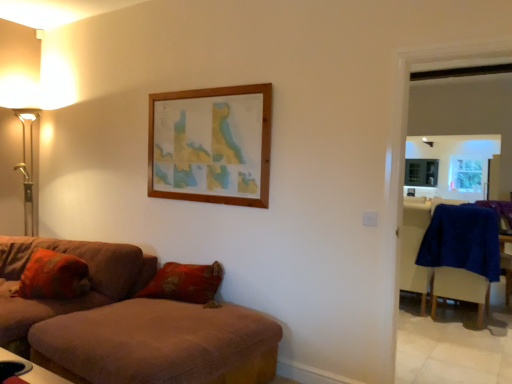
The image size is (512, 384). What do you see at coordinates (53, 276) in the screenshot?
I see `textured orange pillow at lower left` at bounding box center [53, 276].

This screenshot has width=512, height=384. Describe the element at coordinates (462, 254) in the screenshot. I see `blue fuzzy swivel chair at right` at that location.

This screenshot has width=512, height=384. Describe the element at coordinates (131, 324) in the screenshot. I see `brown fabric ottoman at lower left, the 2th studio couch when ordered from left to right` at that location.

Identify the location of gold metallic floor lamp at left. The image size is (512, 384). (35, 87).

What do you see at coordinates (35, 87) in the screenshot?
I see `gold metallic floor lamp at left` at bounding box center [35, 87].

Locate an element on the screen. Image resolution: width=512 pixels, height=384 pixels. brown fabric couch at lower left, arranged as the 2th studio couch when viewed from the right is located at coordinates [73, 298].

From a real-world perspective, which is physically below, brown fabric couch at lower left, arranged as the 2th studio couch when viewed from the right, or blue fabric armchair at right?

brown fabric couch at lower left, arranged as the 2th studio couch when viewed from the right, is physically lower.

In terms of width, does brown fabric couch at lower left, which is the 1th studio couch in left-to-right order, look wider or thinner when compared to blue fabric armchair at right?

In the image, brown fabric couch at lower left, which is the 1th studio couch in left-to-right order, appears to be wider than blue fabric armchair at right.

Is brown fabric couch at lower left, arranged as the 2th studio couch when viewed from the right, in front of or behind blue fabric armchair at right in the image?

In the image, brown fabric couch at lower left, arranged as the 2th studio couch when viewed from the right, appears in front of blue fabric armchair at right.

Consider the image. Can you confirm if brown fabric couch at lower left, arranged as the 2th studio couch when viewed from the right, is shorter than blue fabric armchair at right?

Correct, brown fabric couch at lower left, arranged as the 2th studio couch when viewed from the right, is not as tall as blue fabric armchair at right.

Between brown fabric ottoman at lower left, placed as the first studio couch when sorted from right to left, and textured orange pillow at lower left, which one has less height?

textured orange pillow at lower left is shorter.

Consider the image. Is brown fabric ottoman at lower left, placed as the first studio couch when sorted from right to left, positioned beyond the bounds of textured orange pillow at lower left?

That's correct, brown fabric ottoman at lower left, placed as the first studio couch when sorted from right to left, is outside of textured orange pillow at lower left.

Is point (122, 245) closer to camera compared to point (67, 274)?

No, it is behind (67, 274).

Is brown fabric ottoman at lower left, placed as the first studio couch when sorted from right to left, positioned with its back to textured orange pillow at lower left?

No, brown fabric ottoman at lower left, placed as the first studio couch when sorted from right to left, is not facing the opposite direction of textured orange pillow at lower left.

Which is closer, (413, 263) or (50, 282)?

Point (413, 263).

From the image's perspective, is blue fabric armchair at right positioned above or below textured orange pillow at lower left?

blue fabric armchair at right is below textured orange pillow at lower left.

From a real-world perspective, which object stands above the other?

textured orange pillow at lower left.

Is blue fabric armchair at right oriented towards textured orange pillow at lower left?

No.

Relative to gold metallic floor lamp at left, is brown fabric ottoman at lower left, the 2th studio couch when ordered from left to right, in front or behind?

Clearly, brown fabric ottoman at lower left, the 2th studio couch when ordered from left to right, is in front of gold metallic floor lamp at left.

Is brown fabric ottoman at lower left, placed as the first studio couch when sorted from right to left, oriented away from gold metallic floor lamp at left?

No, gold metallic floor lamp at left is not at the back of brown fabric ottoman at lower left, placed as the first studio couch when sorted from right to left.

How different are the orientations of brown fabric ottoman at lower left, the 2th studio couch when ordered from left to right, and gold metallic floor lamp at left in degrees?

There is a 92.9-degree angle between the facing directions of brown fabric ottoman at lower left, the 2th studio couch when ordered from left to right, and gold metallic floor lamp at left.

Are brown fabric ottoman at lower left, the 2th studio couch when ordered from left to right, and gold metallic floor lamp at left making contact?

No, brown fabric ottoman at lower left, the 2th studio couch when ordered from left to right, is not touching gold metallic floor lamp at left.

From the image's perspective, which is below, blue fabric armchair at right or blue fuzzy swivel chair at right?

blue fuzzy swivel chair at right is shown below in the image.

Does blue fabric armchair at right have a larger size compared to blue fuzzy swivel chair at right?

Incorrect, blue fabric armchair at right is not larger than blue fuzzy swivel chair at right.

Does point (407, 242) lie in front of point (439, 250)?

No.

Would you say blue fuzzy swivel chair at right is part of blue fabric armchair at right's contents?

Definitely not — blue fuzzy swivel chair at right is not inside blue fabric armchair at right.

Which object is positioned more to the left, blue fuzzy swivel chair at right or brown fabric couch at lower left, arranged as the 2th studio couch when viewed from the right?

brown fabric couch at lower left, arranged as the 2th studio couch when viewed from the right, is more to the left.

Is brown fabric couch at lower left, which is the 1th studio couch in left-to-right order, at the back of blue fuzzy swivel chair at right?

blue fuzzy swivel chair at right is not turned away from brown fabric couch at lower left, which is the 1th studio couch in left-to-right order.

In the scene shown: Is blue fuzzy swivel chair at right wider than brown fabric couch at lower left, which is the 1th studio couch in left-to-right order?

In fact, blue fuzzy swivel chair at right might be narrower than brown fabric couch at lower left, which is the 1th studio couch in left-to-right order.

Considering the sizes of objects blue fuzzy swivel chair at right and brown fabric couch at lower left, which is the 1th studio couch in left-to-right order, in the image provided, who is taller, blue fuzzy swivel chair at right or brown fabric couch at lower left, which is the 1th studio couch in left-to-right order,?

blue fuzzy swivel chair at right is taller.

Does point (34, 242) come farther from viewer compared to point (153, 269)?

Yes.

From the image's perspective, is brown fabric ottoman at lower left, the 2th studio couch when ordered from left to right, located above brown fabric couch at lower left, which is the 1th studio couch in left-to-right order?

No, from the image's perspective, brown fabric ottoman at lower left, the 2th studio couch when ordered from left to right, is not over brown fabric couch at lower left, which is the 1th studio couch in left-to-right order.

Does brown fabric ottoman at lower left, the 2th studio couch when ordered from left to right, have a greater width compared to brown fabric couch at lower left, which is the 1th studio couch in left-to-right order?

Incorrect, the width of brown fabric ottoman at lower left, the 2th studio couch when ordered from left to right, does not surpass that of brown fabric couch at lower left, which is the 1th studio couch in left-to-right order.

Could you tell me if brown fabric ottoman at lower left, the 2th studio couch when ordered from left to right, is turned towards brown fabric couch at lower left, arranged as the 2th studio couch when viewed from the right?

No, brown fabric ottoman at lower left, the 2th studio couch when ordered from left to right, does not turn towards brown fabric couch at lower left, arranged as the 2th studio couch when viewed from the right.

Locate an element on the screen. studio couch that is the 1st one when counting downward from the blue fabric armchair at right (from the image's perspective) is located at coordinates (73, 298).

I want to click on pillow on the left of brown fabric ottoman at lower left, placed as the first studio couch when sorted from right to left, so click(53, 276).

Looking at this image, which object lies nearer to the anchor point blue fabric armchair at right, brown fabric ottoman at lower left, placed as the first studio couch when sorted from right to left, or textured orange pillow at lower left?

brown fabric ottoman at lower left, placed as the first studio couch when sorted from right to left, lies closer to blue fabric armchair at right than the other object.

From the picture: Considering their positions, is brown fabric ottoman at lower left, the 2th studio couch when ordered from left to right, positioned closer to gold metallic floor lamp at left than textured orange pillow at lower left?

Based on the image, textured orange pillow at lower left appears to be nearer to gold metallic floor lamp at left.

Based on their spatial positions, is gold metallic floor lamp at left or blue fuzzy swivel chair at right further from brown fabric ottoman at lower left, the 2th studio couch when ordered from left to right?

The object further to brown fabric ottoman at lower left, the 2th studio couch when ordered from left to right, is blue fuzzy swivel chair at right.

Considering their positions, is blue fabric armchair at right positioned further to blue fuzzy swivel chair at right than textured orange pillow at lower left?

textured orange pillow at lower left is positioned further to the anchor blue fuzzy swivel chair at right.

Which object lies nearer to the anchor point blue fabric armchair at right, brown fabric ottoman at lower left, placed as the first studio couch when sorted from right to left, or blue fuzzy swivel chair at right?

The object closer to blue fabric armchair at right is blue fuzzy swivel chair at right.

When comparing their distances from blue fabric armchair at right, does brown fabric couch at lower left, which is the 1th studio couch in left-to-right order, or blue fuzzy swivel chair at right seem further?

brown fabric couch at lower left, which is the 1th studio couch in left-to-right order.

Considering their positions, is blue fabric armchair at right positioned closer to gold metallic floor lamp at left than brown fabric ottoman at lower left, placed as the first studio couch when sorted from right to left?

Among the two, brown fabric ottoman at lower left, placed as the first studio couch when sorted from right to left, is located nearer to gold metallic floor lamp at left.

Considering their positions, is brown fabric ottoman at lower left, placed as the first studio couch when sorted from right to left, positioned further to blue fuzzy swivel chair at right than textured orange pillow at lower left?

textured orange pillow at lower left is positioned further to the anchor blue fuzzy swivel chair at right.

Identify the location of armchair located between brown fabric ottoman at lower left, placed as the first studio couch when sorted from right to left, and blue fuzzy swivel chair at right in the left-right direction. (414, 247).

At what (x,y) coordinates should I click in order to perform the action: click on pillow between brown fabric ottoman at lower left, placed as the first studio couch when sorted from right to left, and gold metallic floor lamp at left, along the z-axis. Please return your answer as a coordinate pair (x, y). The height and width of the screenshot is (384, 512). Looking at the image, I should click on (53, 276).

The height and width of the screenshot is (384, 512). Identify the location of studio couch situated between textured orange pillow at lower left and blue fabric armchair at right from left to right. (131, 324).

Identify the location of armchair between brown fabric couch at lower left, which is the 1th studio couch in left-to-right order, and blue fuzzy swivel chair at right, in the horizontal direction. [x=414, y=247].